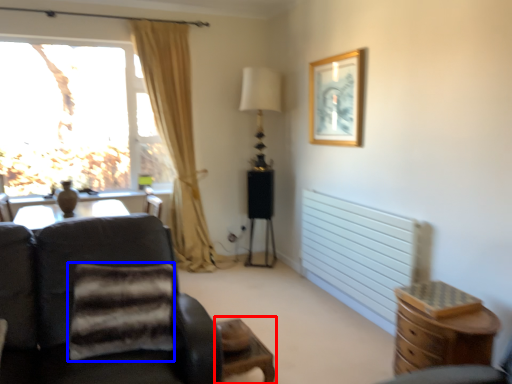
Question: Which point is further to the camera, side table (highlighted by a red box) or pillow (highlighted by a blue box)?

Choices:
 (A) side table
 (B) pillow

Answer: (A)